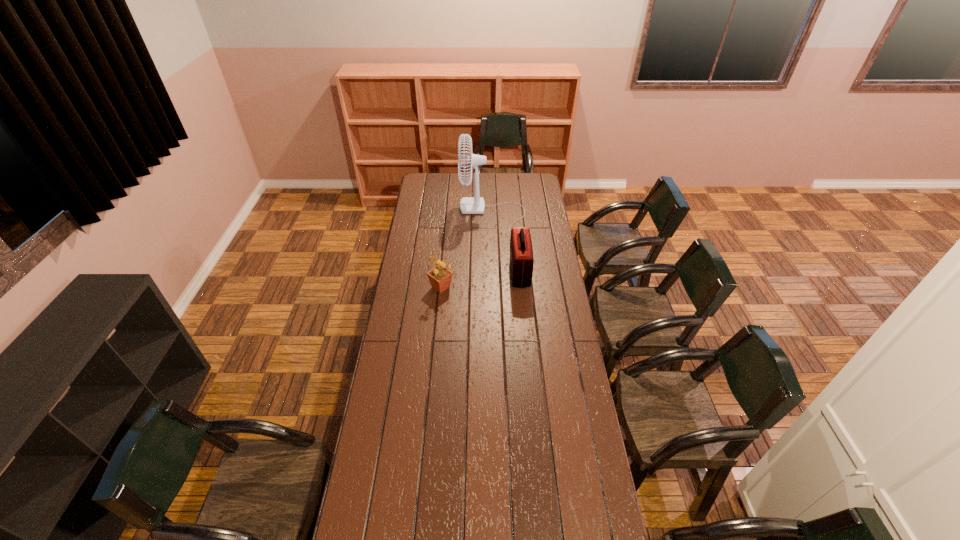
Identify which object is the closest to the tallest object. Please provide its 2D coordinates. Your answer should be formatted as a tuple, i.e. [(x, y)], where the tuple contains the x and y coordinates of a point satisfying the conditions above.

[(521, 252)]

Where is `vacant space that satisfies the following two spatial constraints: 1. on the front-facing side of the fan; 2. at the front of the sunflower with flowers visible`? vacant space that satisfies the following two spatial constraints: 1. on the front-facing side of the fan; 2. at the front of the sunflower with flowers visible is located at coordinates (494, 287).

At what (x,y) coordinates should I click in order to perform the action: click on vacant region that satisfies the following two spatial constraints: 1. on the front-facing side of the farthest object; 2. at the front of the leftmost object with flowers visible. Please return your answer as a coordinate pair (x, y). This screenshot has height=540, width=960. Looking at the image, I should click on (494, 287).

In order to click on vacant space that satisfies the following two spatial constraints: 1. on the side of the first aid kit with the cross symbol; 2. at the front of the leftmost object with flowers visible in this screenshot , I will do `click(521, 287)`.

Image resolution: width=960 pixels, height=540 pixels. What are the coordinates of `vacant region that satisfies the following two spatial constraints: 1. on the front-facing side of the farthest object; 2. at the front of the sunflower with flowers visible` in the screenshot? It's located at (494, 287).

Identify the location of free point that satisfies the following two spatial constraints: 1. on the side of the first aid kit with the cross symbol; 2. at the front of the sunflower with flowers visible. Image resolution: width=960 pixels, height=540 pixels. (521, 287).